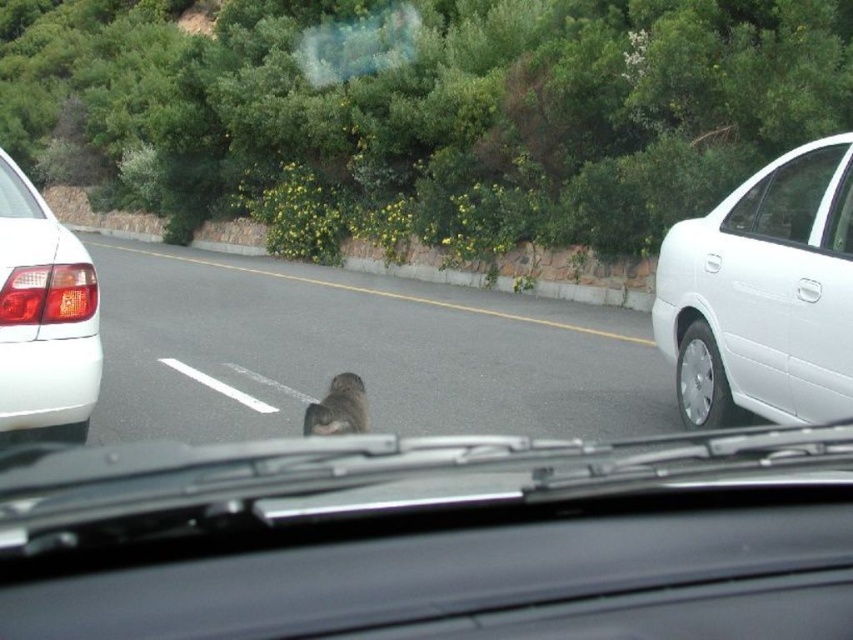
You are a passenger in the car and want to know what is the first object you can see through the windshield. Based on the coordinates provided, can you tell me what is located at point (16,193)?

The point (16,193) marks the transparent glass windshield at upper left, so the first object you can see through the windshield at that coordinate is the transparent glass windshield itself.

In the scene shown: You are driving a car and notice a white metallic car at right and a black plastic license plate at center in your view. Which object is wider?

The white metallic car at right is wider than the black plastic license plate at center according to the description.

You are a passenger in a car and looking out the window. You see a white glossy sedan at left and a black plastic license plate at left. Which one is located more to the left side of the scene?

The black plastic license plate at left is more to the left side of the scene because the white glossy sedan at left is positioned to its right.